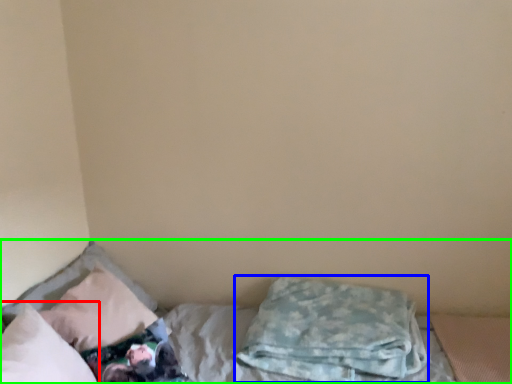
Question: Estimate the real-world distances between objects in this image. Which object is farther from pillow (highlighted by a red box), pillow (highlighted by a blue box) or bed (highlighted by a green box)?

Choices:
 (A) pillow
 (B) bed

Answer: (A)